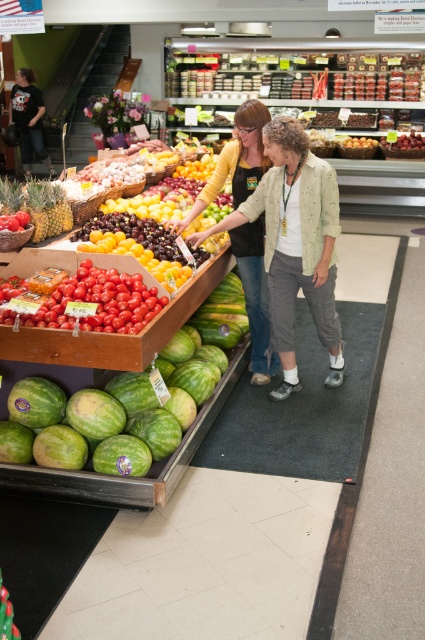
Consider the image. Which of these two, green matte watermelon at lower left or shiny red cherries at center, stands taller?

green matte watermelon at lower left

Is point (221, 273) behind point (411, 145)?

No.

Where is `green matte watermelon at lower left`? green matte watermelon at lower left is located at coordinates (113, 333).

Can you confirm if light green textured jacket at center is positioned to the left of glossy yellow plums at center?

In fact, light green textured jacket at center is to the right of glossy yellow plums at center.

Is point (325, 179) closer to camera compared to point (155, 269)?

No, (325, 179) is behind (155, 269).

The width and height of the screenshot is (425, 640). Identify the location of light green textured jacket at center. (294, 243).

Between point (62, 282) and point (124, 220), which one is positioned in front?

Positioned in front is point (62, 282).

Between red matte tomatoes at center and glossy yellow plums at center, which one is positioned lower?

red matte tomatoes at center is lower down.

Measure the distance between point (39,323) and camera.

Point (39,323) is 2.80 meters from camera.

You are a GUI agent. You are given a task and a screenshot of the screen. Output one action in this format:
    pyautogui.click(x=<x>, y=<y>)
    Task: Click on the red matte tomatoes at center
    The width and height of the screenshot is (425, 640).
    Given the screenshot: What is the action you would take?
    pyautogui.click(x=99, y=301)